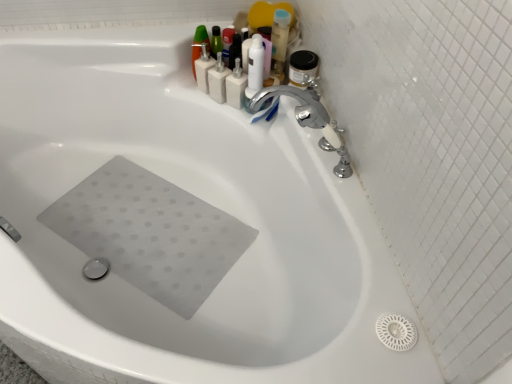
Question: Considering the positions of white matte bottles at upper center, which is the 2th toiletry from left to right, and white plastic pump at upper center, the fourth toiletry in the left-to-right sequence, in the image, is white matte bottles at upper center, which is the 2th toiletry from left to right, wider or thinner than white plastic pump at upper center, the fourth toiletry in the left-to-right sequence,?

Choices:
 (A) wide
 (B) thin

Answer: (A)

Question: In terms of height, does white matte bottles at upper center, arranged as the 3th toiletry when viewed from the right, look taller or shorter compared to white plastic pump at upper center, which is counted as the 1th toiletry, starting from the right?

Choices:
 (A) tall
 (B) short

Answer: (A)

Question: Which of these objects is positioned farthest from the white matte bottles at upper center, arranged as the 3th toiletry when viewed from the right?

Choices:
 (A) matte black pump bottle at upper center, arranged as the 2th toiletry when viewed from the right
 (B) white plastic pump at upper center, which is counted as the 1th toiletry, starting from the right
 (C) silver metallic faucet at upper right, the 2th tap viewed from the front
 (D) chrome metallic faucet at upper right, which is counted as the 1th tap, starting from the front
 (E) white plastic soap dispenser at upper center, marked as the first toiletry in a left-to-right arrangement

Answer: (D)

Question: Which of these objects is positioned farthest from the silver metallic faucet at upper right, which is counted as the first tap, starting from the back?

Choices:
 (A) chrome metallic faucet at upper right, the 2th tap from the back
 (B) white plastic pump at upper center, which is counted as the 1th toiletry, starting from the right
 (C) white matte bottles at upper center, which is the 2th toiletry from left to right
 (D) white plastic soap dispenser at upper center, which ranks as the fourth toiletry in right-to-left order
 (E) matte black pump bottle at upper center, marked as the third toiletry in a left-to-right arrangement

Answer: (D)